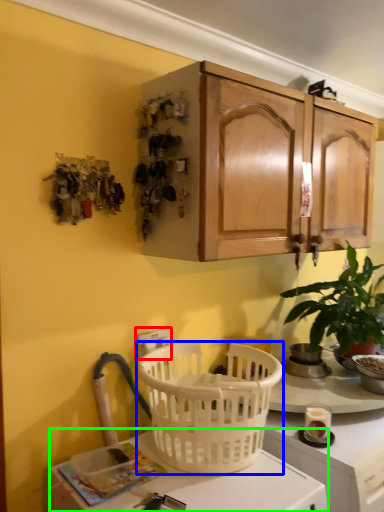
Question: Which object is positioned closest to electric outlet (highlighted by a red box)? Select from picnic basket (highlighted by a blue box) and desk (highlighted by a green box).

Choices:
 (A) picnic basket
 (B) desk

Answer: (A)